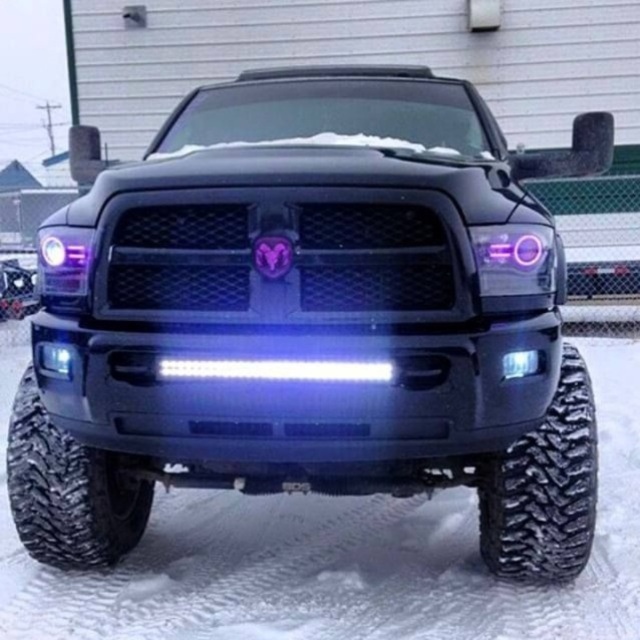
Is black textured tire at lower right in front of black rubber tire at lower left?

Yes, it is in front of black rubber tire at lower left.

Does black textured tire at lower right have a greater width compared to black rubber tire at lower left?

Incorrect, black textured tire at lower right's width does not surpass black rubber tire at lower left's.

Is point (541, 422) positioned after point (83, 547)?

No, it is not.

The height and width of the screenshot is (640, 640). I want to click on black textured tire at lower right, so click(x=545, y=488).